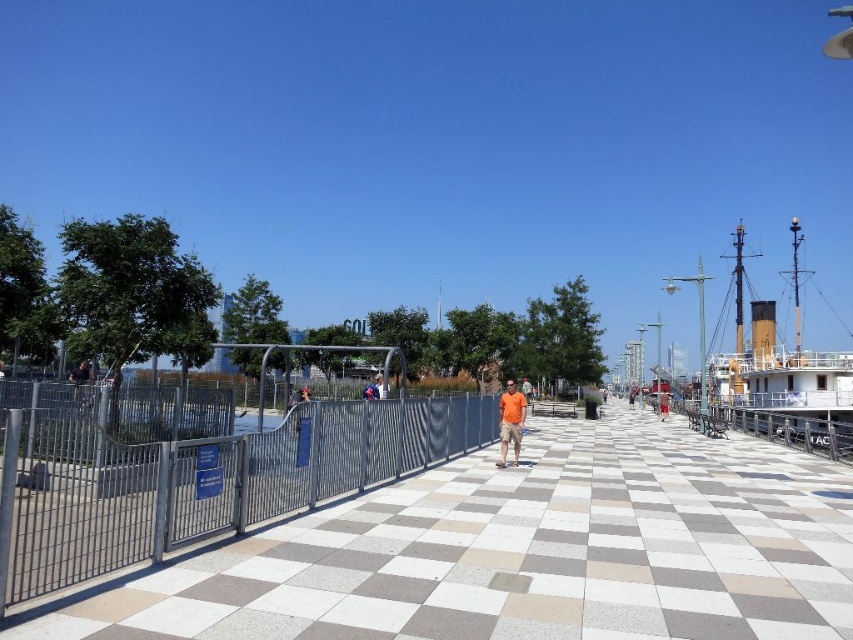
Question: Is white checkered pavement at center smaller than matte black shirt at left?

Choices:
 (A) no
 (B) yes

Answer: (A)

Question: Which point appears closest to the camera in this image?

Choices:
 (A) (741, 346)
 (B) (733, 547)
 (C) (502, 465)
 (D) (80, 381)

Answer: (B)

Question: Which of the following is the closest to the observer?

Choices:
 (A) matte black shirt at left
 (B) white checkered pavement at center

Answer: (B)

Question: Among these points, which one is nearest to the camera?

Choices:
 (A) (851, 428)
 (B) (503, 467)
 (C) (82, 392)

Answer: (C)

Question: Is white checkered pavement at center to the right of matte black shirt at left from the viewer's perspective?

Choices:
 (A) yes
 (B) no

Answer: (A)

Question: Considering the relative positions of white checkered pavement at center and white wooden ship at right in the image provided, where is white checkered pavement at center located with respect to white wooden ship at right?

Choices:
 (A) above
 (B) below

Answer: (B)